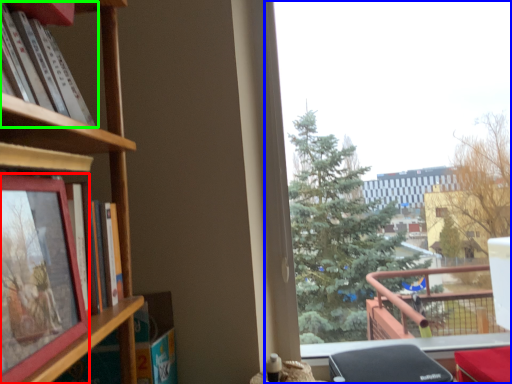
Question: Estimate the real-world distances between objects in this image. Which object is farther from picture frame (highlighted by a red box), window (highlighted by a blue box) or book (highlighted by a green box)?

Choices:
 (A) window
 (B) book

Answer: (A)